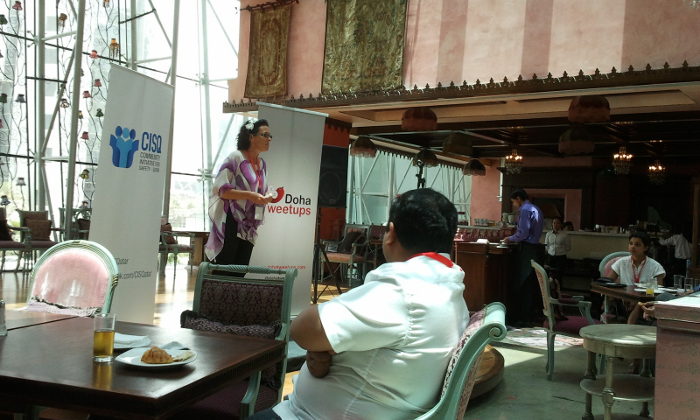
Where is `drinking glass`? Image resolution: width=700 pixels, height=420 pixels. drinking glass is located at coordinates point(102,341).